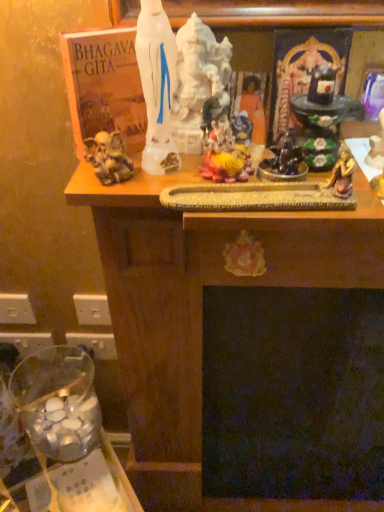
Question: In the image, is white glossy statue at upper center positioned in front of or behind matte orange statue at center?

Choices:
 (A) front
 (B) behind

Answer: (A)

Question: Looking at the image, does white glossy statue at upper center seem bigger or smaller compared to matte orange statue at center?

Choices:
 (A) big
 (B) small

Answer: (A)

Question: Which is nearer to the matte orange statue at center?

Choices:
 (A) white glossy statue at upper center
 (B) clear glass jar at lower left

Answer: (A)

Question: Estimate the real-world distances between objects in this image. Which object is closer to the clear glass jar at lower left?

Choices:
 (A) white glossy statue at upper center
 (B) matte orange statue at center

Answer: (A)